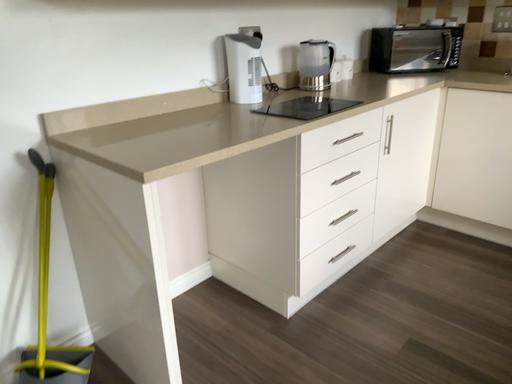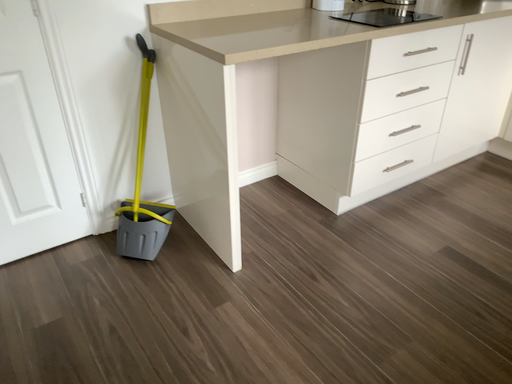
Question: How did the camera likely rotate when shooting the video?

Choices:
 (A) rotated right
 (B) rotated left

Answer: (B)